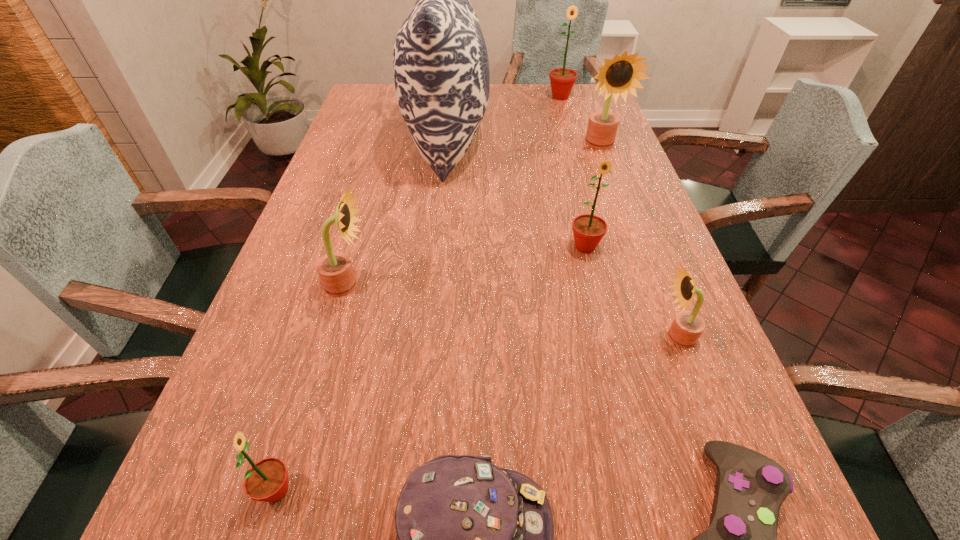
The height and width of the screenshot is (540, 960). I want to click on the second closest sunflower to the farthest object, so click(588, 230).

Where is `the closest yellow sunflower to the smallest yellow sunflower`? Image resolution: width=960 pixels, height=540 pixels. the closest yellow sunflower to the smallest yellow sunflower is located at coordinates (335, 269).

Select which yellow sunflower appears as the closest to the biggest yellow sunflower. Please provide its 2D coordinates. Your answer should be formatted as a tuple, i.e. [(x, y)], where the tuple contains the x and y coordinates of a point satisfying the conditions above.

[(687, 327)]

Choose which green sunflower is the nearest neighbor to the leftmost green sunflower. Please provide its 2D coordinates. Your answer should be formatted as a tuple, i.e. [(x, y)], where the tuple contains the x and y coordinates of a point satisfying the conditions above.

[(588, 230)]

Find the location of `green sunflower that is the second nearest to the nearest green sunflower`. green sunflower that is the second nearest to the nearest green sunflower is located at coordinates (562, 80).

Find the location of a particular element. The height and width of the screenshot is (540, 960). free spot that satisfies the following two spatial constraints: 1. on the face of the second biggest green sunflower; 2. on the face of the second nearest yellow sunflower is located at coordinates (594, 285).